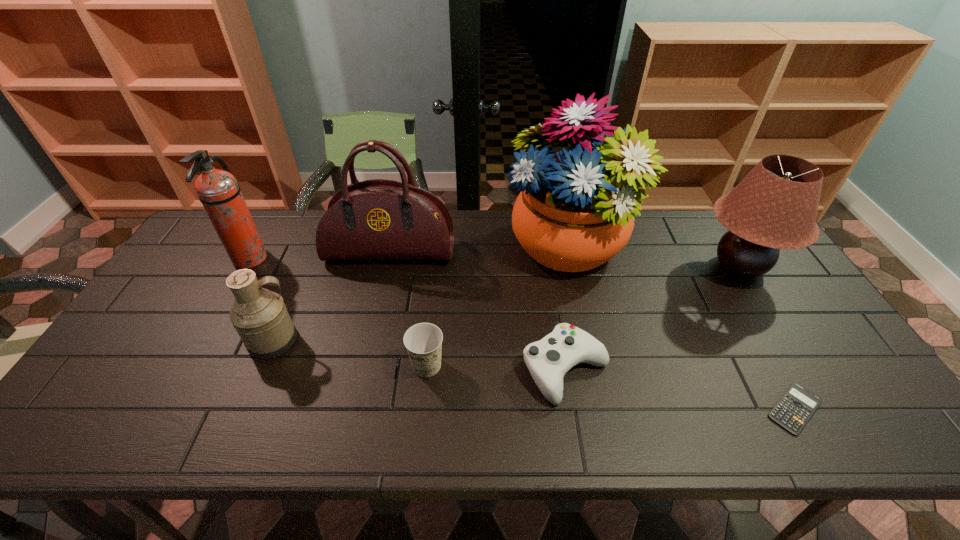
Where is `free spot between the handbag and the shortest object`? Image resolution: width=960 pixels, height=540 pixels. free spot between the handbag and the shortest object is located at coordinates (592, 330).

What are the coordinates of `the second closest object relative to the control` in the screenshot? It's located at click(x=423, y=341).

Where is `object that is the third closest one to the Dixie cup`? object that is the third closest one to the Dixie cup is located at coordinates (260, 317).

Where is `vacant space that satisfies the following two spatial constraints: 1. at the nozzle of the fire extinguisher; 2. on the back side of the pitcher`? The height and width of the screenshot is (540, 960). vacant space that satisfies the following two spatial constraints: 1. at the nozzle of the fire extinguisher; 2. on the back side of the pitcher is located at coordinates (204, 340).

I want to click on free spot that satisfies the following two spatial constraints: 1. on the front side of the sixth tallest object; 2. on the left side of the pitcher, so click(x=263, y=366).

Identify the location of free space that satisfies the following two spatial constraints: 1. at the nozzle of the leftmost object; 2. on the right side of the calculator. (165, 408).

The width and height of the screenshot is (960, 540). I want to click on vacant point that satisfies the following two spatial constraints: 1. on the front-facing side of the lampshade; 2. on the front side of the Dixie cup, so click(x=800, y=366).

You are a GUI agent. You are given a task and a screenshot of the screen. Output one action in this format:
    pyautogui.click(x=<x>, y=<y>)
    Task: Click on the free spot that satisfies the following two spatial constraints: 1. on the front-facing side of the lampshade; 2. on the front side of the second shortest object
    The height and width of the screenshot is (540, 960).
    Given the screenshot: What is the action you would take?
    pyautogui.click(x=803, y=369)

Where is `free spot that satisfies the following two spatial constraints: 1. on the front side of the control; 2. on the left side of the fifth tallest object`? The height and width of the screenshot is (540, 960). free spot that satisfies the following two spatial constraints: 1. on the front side of the control; 2. on the left side of the fifth tallest object is located at coordinates (261, 369).

Where is `vacant region that satisfies the following two spatial constraints: 1. on the front side of the third shortest object; 2. on the right side of the fifth tallest object`? The image size is (960, 540). vacant region that satisfies the following two spatial constraints: 1. on the front side of the third shortest object; 2. on the right side of the fifth tallest object is located at coordinates (263, 366).